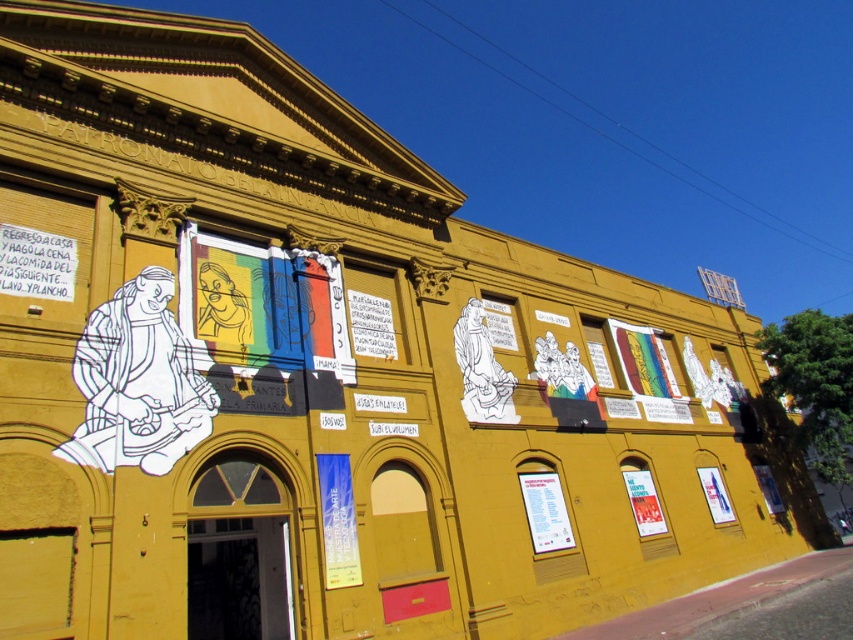
You are an art student analyzing the murals and posters on the yellow building. You notice two posters, the white paper poster at center and the matte white poster at lower right. Which poster is placed higher up on the building?

The white paper poster at center is positioned over the matte white poster at lower right, meaning it is placed higher up on the building.

You are standing in front of the yellow building and want to locate the white paper poster at upper left. According to the coordinates provided, where exactly should you look to find it?

The white paper poster at upper left is located at point [36,262], so you should look towards the upper left area of the building facade at those coordinates to find it.

Consider the image. You are standing in front of the yellow building and want to read both the white paper poster at upper left and the white paper poster at center. Which poster should you look at first to read the one closer to you?

The white paper poster at upper left is closer to the viewer, so you should look at it first.